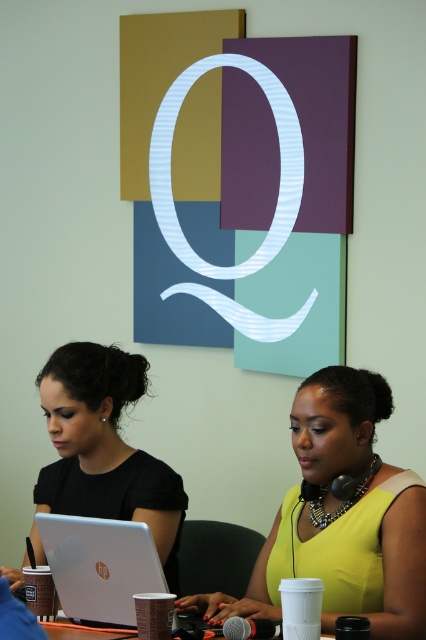
Image resolution: width=426 pixels, height=640 pixels. What do you see at coordinates (342, 516) in the screenshot? I see `yellow matte dress at center` at bounding box center [342, 516].

Which is in front, point (316, 468) or point (135, 554)?

Positioned in front is point (135, 554).

Find the location of a particular element. yellow matte dress at center is located at coordinates (342, 516).

Is point (43, 406) behind point (68, 582)?

Yes, point (43, 406) is behind point (68, 582).

Who is more forward, [118,378] or [124,566]?

Point [124,566]

Find the location of a particular element. black matte laptop at left is located at coordinates (104, 448).

Is yellow matte dress at center thinner than black matte laptop at left?

Incorrect, yellow matte dress at center's width is not less than black matte laptop at left's.

Between yellow matte dress at center and black matte laptop at left, which one is positioned higher?

black matte laptop at left

The height and width of the screenshot is (640, 426). Describe the element at coordinates (342, 516) in the screenshot. I see `yellow matte dress at center` at that location.

Locate an element on the screen. Image resolution: width=426 pixels, height=640 pixels. yellow matte dress at center is located at coordinates (342, 516).